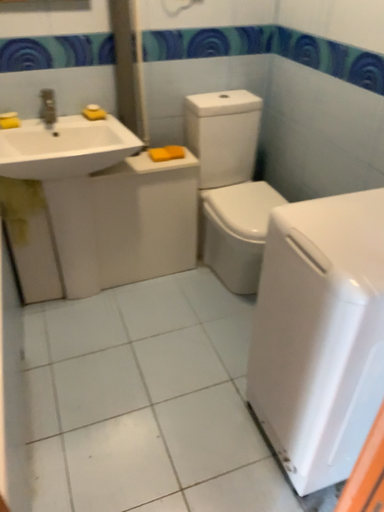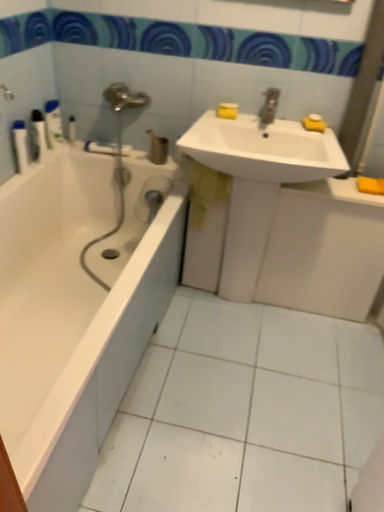
Question: How did the camera likely rotate when shooting the video?

Choices:
 (A) rotated left
 (B) rotated right

Answer: (A)